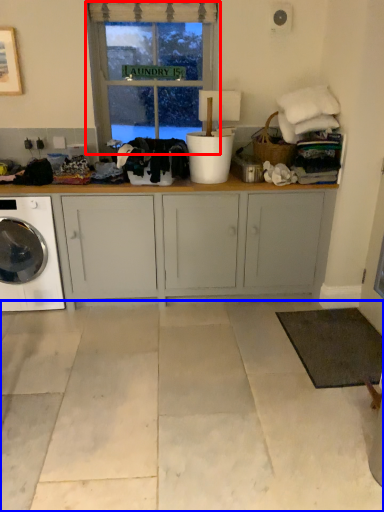
Question: Which object appears closest to the camera in this image, window (highlighted by a red box) or concrete (highlighted by a blue box)?

Choices:
 (A) window
 (B) concrete

Answer: (B)